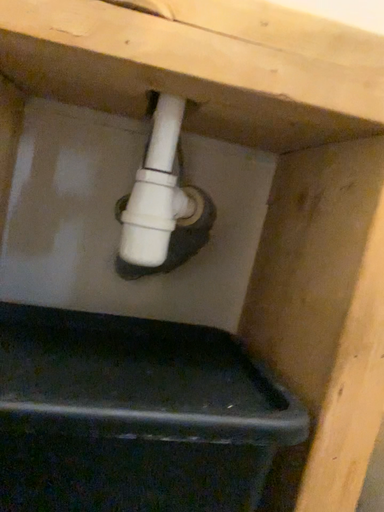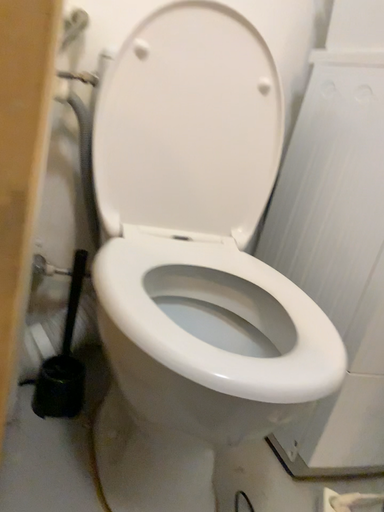
Question: Which way did the camera rotate in the video?

Choices:
 (A) rotated downward
 (B) rotated upward

Answer: (A)